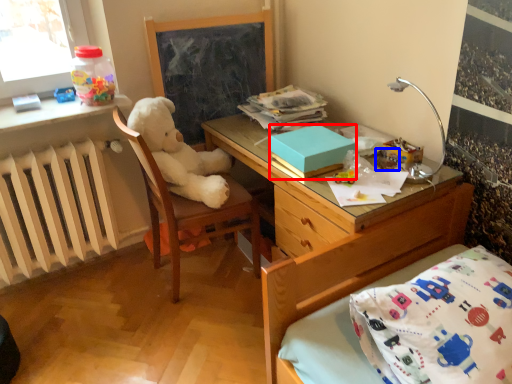
Question: Among these objects, which one is nearest to the camera, box (highlighted by a red box) or toy (highlighted by a blue box)?

Choices:
 (A) box
 (B) toy

Answer: (A)